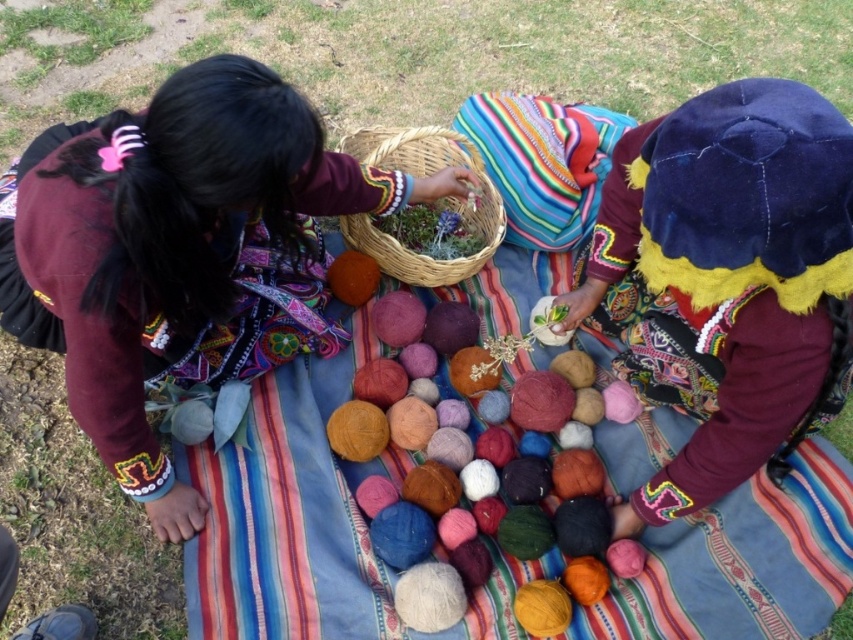
You are a craft instructor observing two students working on a project. You need to check if the soft wool balls at center can be stored inside the woven natural basket at center. Based on their sizes, what do you think?

The soft wool balls at center is much taller than the woven natural basket at center, so they cannot be stored inside the basket.

You are standing at point (426, 257) and want to walk to point (688, 262). Which direction should you move in?

You should move forward because point (688, 262) is in front of point (426, 257).